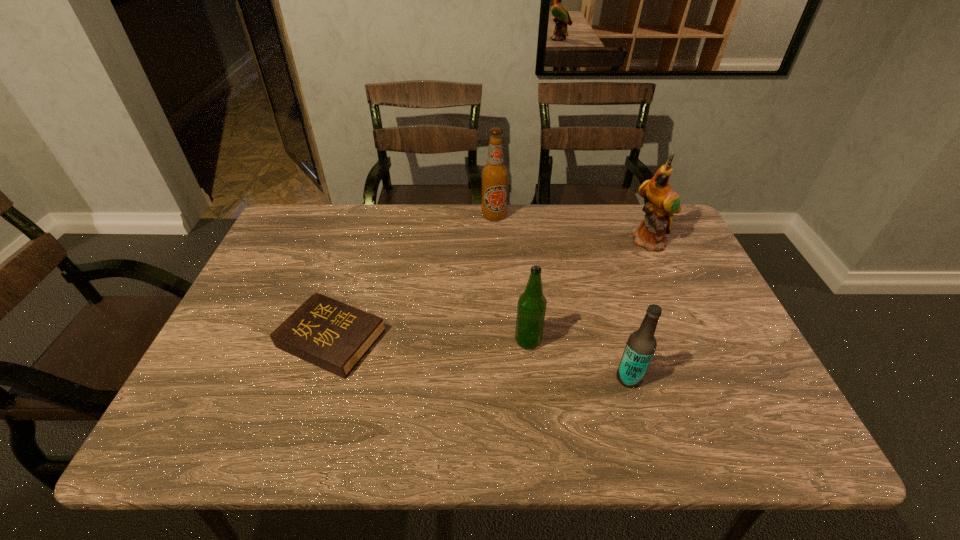
At what (x,y) coordinates should I click in order to perform the action: click on vacant space situated on the front label of the farthest object. Please return your answer as a coordinate pair (x, y). Image resolution: width=960 pixels, height=540 pixels. Looking at the image, I should click on (497, 302).

Where is `vacant region located on the label of the second farthest beer bottle`? vacant region located on the label of the second farthest beer bottle is located at coordinates (400, 341).

Find the location of a particular element. This screenshot has width=960, height=540. vacant area situated on the label of the second farthest beer bottle is located at coordinates (476, 341).

Find the location of `free spot located on the label of the second farthest beer bottle`. free spot located on the label of the second farthest beer bottle is located at coordinates (392, 341).

At what (x,y) coordinates should I click in order to perform the action: click on free location located on the label of the second object from right to left. Please return your answer as a coordinate pair (x, y). Looking at the image, I should click on (484, 378).

You are a GUI agent. You are given a task and a screenshot of the screen. Output one action in this format:
    pyautogui.click(x=<x>, y=<y>)
    Task: Click on the blank area located on the label of the second object from right to left
    Image resolution: width=960 pixels, height=540 pixels.
    Given the screenshot: What is the action you would take?
    pyautogui.click(x=562, y=378)

Where is `free space located on the label of the second object from right to left`? The image size is (960, 540). free space located on the label of the second object from right to left is located at coordinates (580, 378).

Find the location of `vacant region located 0.320m on the right of the shortest object`. vacant region located 0.320m on the right of the shortest object is located at coordinates (518, 339).

Find the location of a particular element. parrot present at the far edge is located at coordinates (663, 202).

This screenshot has height=540, width=960. Identify the location of beer bottle that is at the far edge. (494, 174).